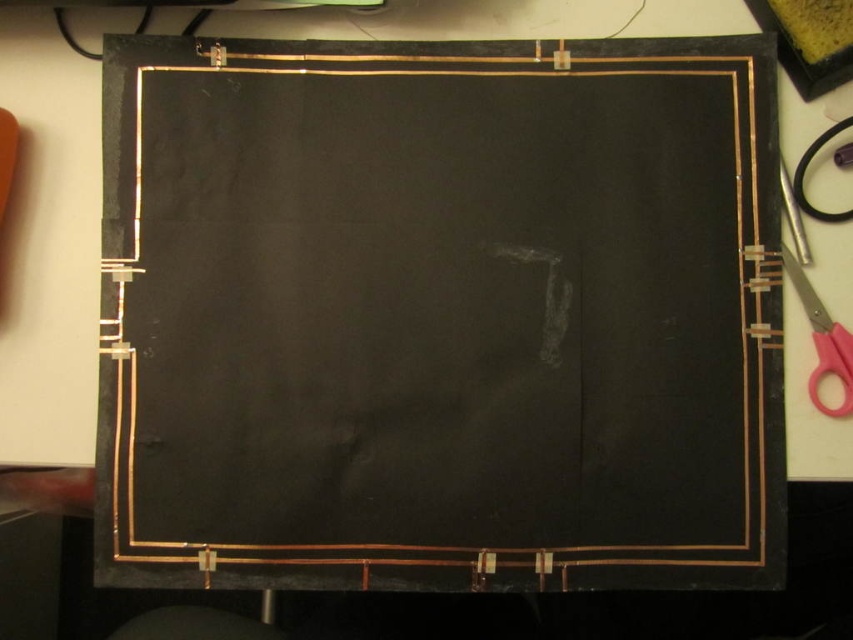
From the picture: You are an artist who wants to place a new sticker exactly at the center of the black matte board at center. According to the image, where should you place the sticker?

The 2D location of the black matte board at center is at point (x=438, y=316), so you should place the sticker at those coordinates.

You need to cut a piece of paper using the pink plastic scissors at right. The black matte board at center is in the way. Can you move the scissors to the right to get them out of the way?

The black matte board at center is on the left side of the pink plastic scissors at right, so moving the scissors to the right would not remove the obstruction caused by the black matte board at center. You should move the scissors to the left instead.

You are an art student who needs to cut the black matte board at center with the pink plastic scissors at right. Can the scissors handle the board based on their size?

The black matte board at center is larger than the pink plastic scissors at right, so the scissors may not be able to cut the entire board in one go and might require multiple cuts or a different tool for larger sections.